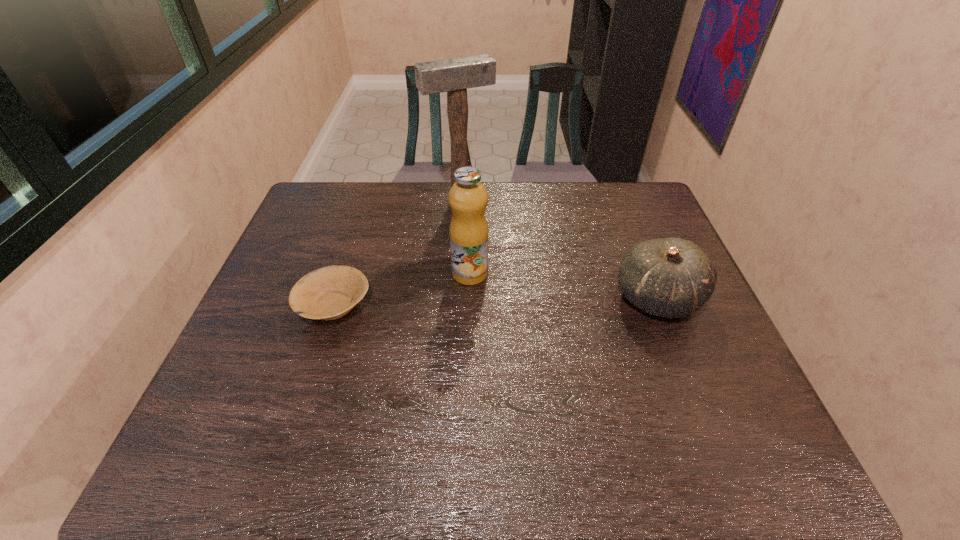
I want to click on vacant region between the mallet and the rightmost object, so click(559, 249).

Locate an element on the screen. object identified as the second closest to the gourd is located at coordinates (454, 76).

Locate an element on the screen. The width and height of the screenshot is (960, 540). object that ranks as the second closest to the mallet is located at coordinates (328, 293).

Locate an element on the screen. This screenshot has width=960, height=540. free region that satisfies the following two spatial constraints: 1. on the front side of the second shortest object; 2. on the left side of the tallest object is located at coordinates (455, 298).

At what (x,y) coordinates should I click in order to perform the action: click on vacant area in the image that satisfies the following two spatial constraints: 1. on the front side of the second shortest object; 2. on the right side of the tallest object. Please return your answer as a coordinate pair (x, y). Looking at the image, I should click on (455, 298).

The height and width of the screenshot is (540, 960). I want to click on free region that satisfies the following two spatial constraints: 1. on the front side of the third shortest object; 2. on the right side of the mallet, so click(x=456, y=273).